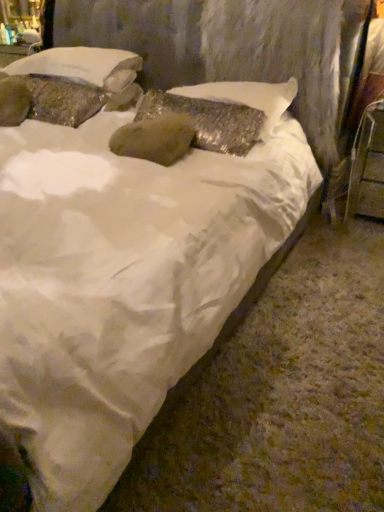
Question: Is textured stone pillow at upper left, placed as the 2th pillow when sorted from right to left, further to the viewer compared to shiny metallic pillow at center, placed as the third pillow when sorted from left to right?

Choices:
 (A) yes
 (B) no

Answer: (A)

Question: Considering the relative sizes of textured stone pillow at upper left, placed as the 2th pillow when sorted from right to left, and shiny metallic pillow at center, placed as the third pillow when sorted from left to right, in the image provided, is textured stone pillow at upper left, placed as the 2th pillow when sorted from right to left, wider than shiny metallic pillow at center, placed as the third pillow when sorted from left to right,?

Choices:
 (A) no
 (B) yes

Answer: (B)

Question: Is textured stone pillow at upper left, placed as the 2th pillow when sorted from right to left, not near shiny metallic pillow at center, placed as the third pillow when sorted from left to right?

Choices:
 (A) no
 (B) yes

Answer: (A)

Question: From the image's perspective, would you say textured stone pillow at upper left, placed as the 2th pillow when sorted from right to left, is shown under shiny metallic pillow at center, placed as the 1th pillow when sorted from right to left?

Choices:
 (A) no
 (B) yes

Answer: (A)

Question: From a real-world perspective, does textured stone pillow at upper left, arranged as the 2th pillow when viewed from the left, stand above shiny metallic pillow at center, placed as the 1th pillow when sorted from right to left?

Choices:
 (A) yes
 (B) no

Answer: (A)

Question: Considering the positions of metallic silver chair at right and textured stone pillow at upper left, placed as the 2th pillow when sorted from right to left, in the image, is metallic silver chair at right taller or shorter than textured stone pillow at upper left, placed as the 2th pillow when sorted from right to left,?

Choices:
 (A) tall
 (B) short

Answer: (A)

Question: Does point (359, 155) appear closer or farther from the camera than point (109, 52)?

Choices:
 (A) farther
 (B) closer

Answer: (A)

Question: Based on their sizes in the image, would you say metallic silver chair at right is bigger or smaller than textured stone pillow at upper left, placed as the 2th pillow when sorted from right to left?

Choices:
 (A) big
 (B) small

Answer: (B)

Question: Based on their positions, is metallic silver chair at right located to the left or right of textured stone pillow at upper left, arranged as the 2th pillow when viewed from the left?

Choices:
 (A) left
 (B) right

Answer: (B)

Question: Based on their sizes in the image, would you say textured stone pillow at upper left, marked as the 1th pillow in a left-to-right arrangement, is bigger or smaller than metallic silver chair at right?

Choices:
 (A) small
 (B) big

Answer: (A)

Question: Based on their positions, is textured stone pillow at upper left, acting as the 3th pillow starting from the right, located to the left or right of metallic silver chair at right?

Choices:
 (A) right
 (B) left

Answer: (B)

Question: From the image's perspective, is textured stone pillow at upper left, marked as the 1th pillow in a left-to-right arrangement, located above or below metallic silver chair at right?

Choices:
 (A) above
 (B) below

Answer: (A)

Question: In terms of width, does textured stone pillow at upper left, marked as the 1th pillow in a left-to-right arrangement, look wider or thinner when compared to metallic silver chair at right?

Choices:
 (A) thin
 (B) wide

Answer: (A)

Question: Is point (223, 97) closer or farther from the camera than point (46, 97)?

Choices:
 (A) closer
 (B) farther

Answer: (A)

Question: From a real-world perspective, is shiny metallic pillow at center, placed as the third pillow when sorted from left to right, positioned above or below textured stone pillow at upper left, marked as the 1th pillow in a left-to-right arrangement?

Choices:
 (A) above
 (B) below

Answer: (A)